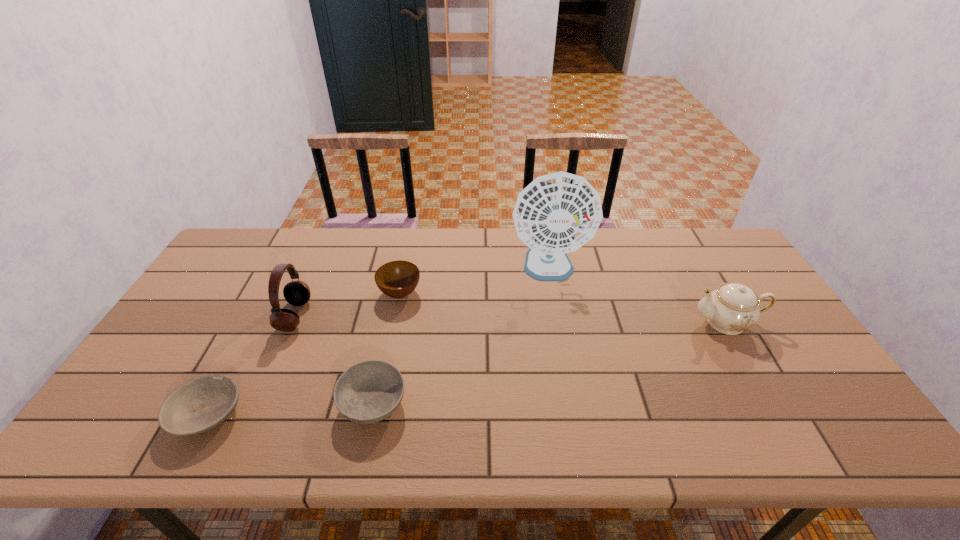
Locate an element on the screen. the tallest object is located at coordinates (557, 213).

Locate an element on the screen. the second object from right to left is located at coordinates (557, 213).

Find the location of a particular element. The height and width of the screenshot is (540, 960). headset is located at coordinates (297, 293).

Where is `chinaware`? chinaware is located at coordinates (732, 308).

Locate an element on the screen. the third tallest object is located at coordinates (732, 308).

Locate an element on the screen. This screenshot has height=540, width=960. the farthest bowl is located at coordinates (396, 279).

Locate an element on the screen. Image resolution: width=960 pixels, height=540 pixels. the shortest bowl is located at coordinates (200, 404).

Where is `the shortest object`? The width and height of the screenshot is (960, 540). the shortest object is located at coordinates (200, 404).

I want to click on vacant area situated on the grille of the fifth object from left to right, so point(571,390).

Identify the location of free spot located 0.160m on the ear pads of the second tallest object. The image size is (960, 540). (363, 316).